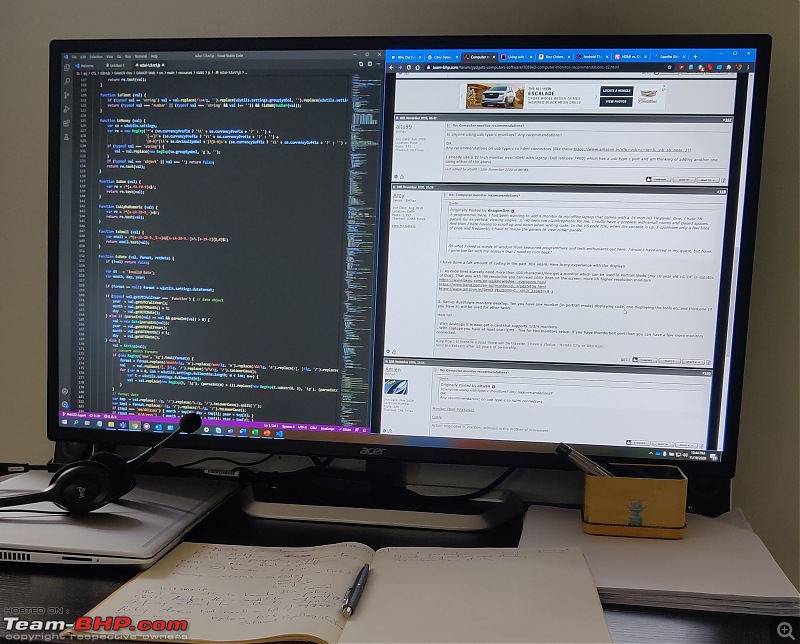
At what (x,y) coordinates should I click in order to perform the action: click on pen. Please return your answer as a coordinate pair (x, y). Looking at the image, I should click on (356, 587), (573, 451).